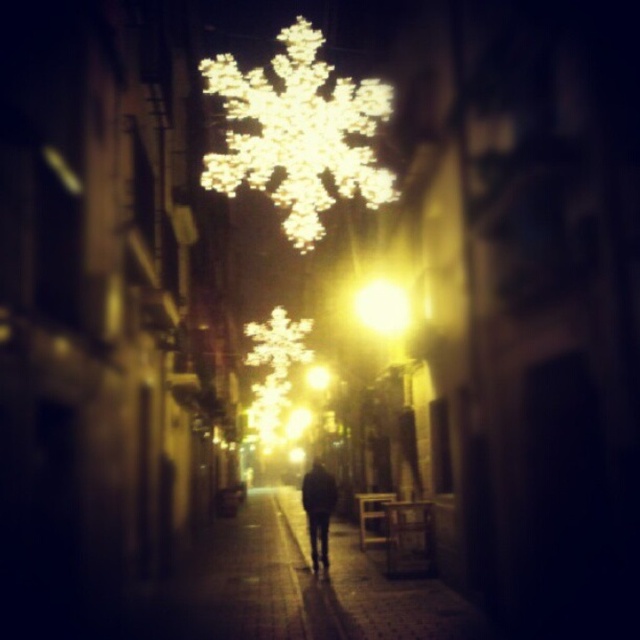
Is illuminated plastic snowflake at center thinner than yellow matte light at center?

Incorrect, illuminated plastic snowflake at center's width is not less than yellow matte light at center's.

Between illuminated plastic snowflake at center and yellow matte light at center, which one appears on the right side from the viewer's perspective?

yellow matte light at center is more to the right.

Is point (324, 150) positioned in front of point (365, 326)?

Yes.

Identify the location of illuminated plastic snowflake at center. The image size is (640, 640). (298, 132).

Is smooth stone pavement at center thinner than yellow matte light at center?

Incorrect, smooth stone pavement at center's width is not less than yellow matte light at center's.

Is point (268, 634) behind point (408, 324)?

No, (268, 634) is closer to viewer.

Image resolution: width=640 pixels, height=640 pixels. Identify the location of smooth stone pavement at center. (310, 582).

Does smooth stone pavement at center have a greater height compared to dark gray coat at center?

Indeed, smooth stone pavement at center has a greater height compared to dark gray coat at center.

Who is more forward, (429, 602) or (301, 500)?

Point (429, 602) is in front.

Which is behind, point (340, 529) or point (323, 570)?

Point (340, 529)

Locate an element on the screen. The image size is (640, 640). smooth stone pavement at center is located at coordinates (310, 582).